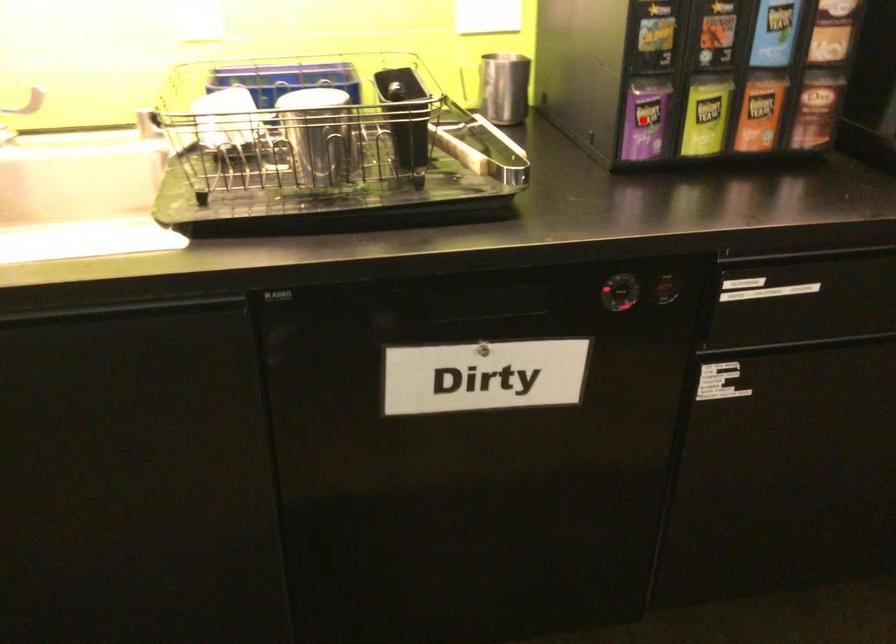
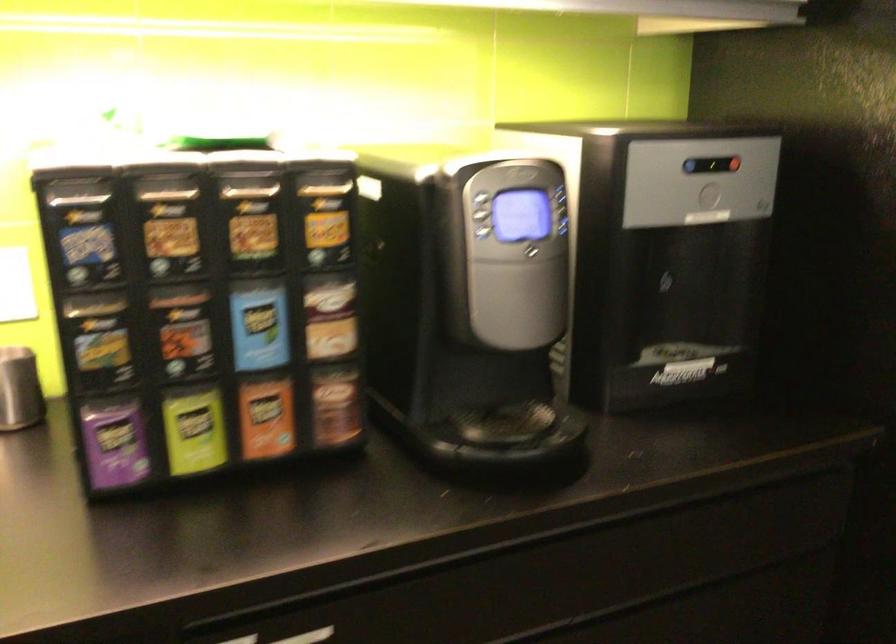
Question: I am providing you with two images of the same scene from different viewpoints. A red point is shown in image1. For the corresponding object point in image2, is it positioned nearer or farther from the camera?

Choices:
 (A) Nearer
 (B) Farther

Answer: (A)